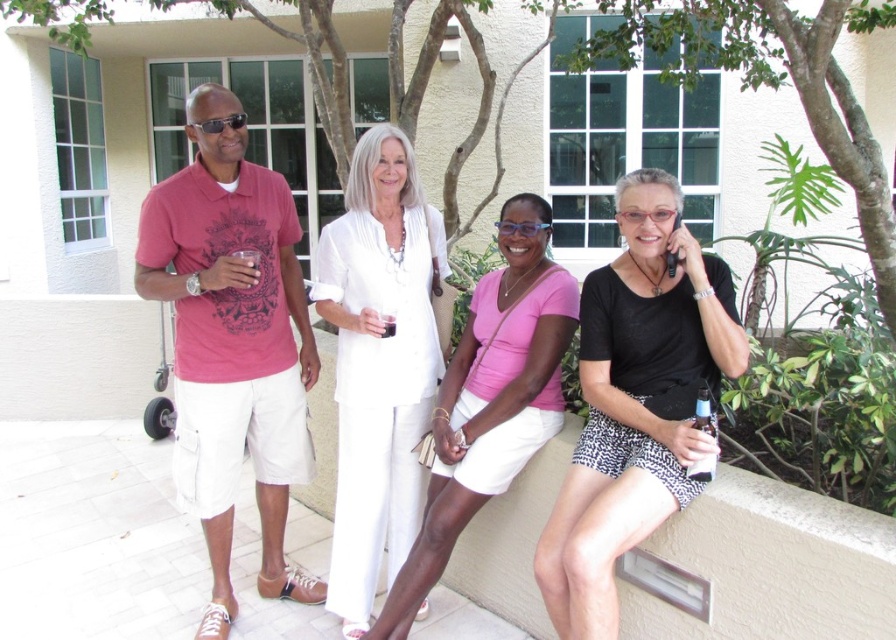
Which is in front, point (494, 404) or point (695, 468)?

Positioned in front is point (695, 468).

Between point (435, 564) and point (708, 426), which one is positioned behind?

Positioned behind is point (435, 564).

In order to click on white cotton dress at center in this screenshot , I will do `click(490, 397)`.

Who is shorter, black matte shirt at center or matte black sunglasses at upper left?

matte black sunglasses at upper left is shorter.

Which is more to the right, black matte shirt at center or matte black sunglasses at upper left?

black matte shirt at center

Which is in front, point (558, 502) or point (212, 122)?

Positioned in front is point (558, 502).

Locate an element on the screen. The width and height of the screenshot is (896, 640). black matte shirt at center is located at coordinates (636, 401).

Is matte pink shirt at left taller than matte black sunglasses at upper left?

Yes, matte pink shirt at left is taller than matte black sunglasses at upper left.

Between point (211, 84) and point (214, 120), which one is positioned behind?

The point (211, 84) is behind.

What do you see at coordinates (503, 387) in the screenshot?
I see `matte pink shirt at left` at bounding box center [503, 387].

Where is `matte pink shirt at left`? This screenshot has height=640, width=896. matte pink shirt at left is located at coordinates (503, 387).